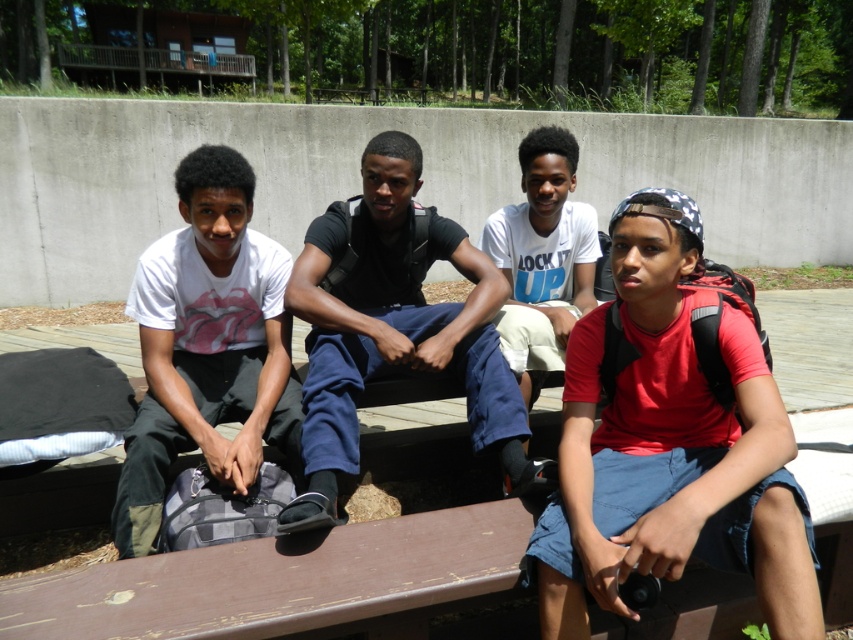
Who is taller, brown wooden bench at center or white matte t-shirt at left?

Standing taller between the two is white matte t-shirt at left.

Describe the element at coordinates (285, 582) in the screenshot. The image size is (853, 640). I see `brown wooden bench at center` at that location.

Find the location of a particular element. The width and height of the screenshot is (853, 640). brown wooden bench at center is located at coordinates tap(285, 582).

Between red matte shirt at right and white cotton shirt at center, which one appears on the left side from the viewer's perspective?

white cotton shirt at center is more to the left.

Who is lower down, red matte shirt at right or white cotton shirt at center?

red matte shirt at right

This screenshot has width=853, height=640. Describe the element at coordinates (670, 448) in the screenshot. I see `red matte shirt at right` at that location.

At what (x,y) coordinates should I click in order to perform the action: click on red matte shirt at right. Please return your answer as a coordinate pair (x, y). Image resolution: width=853 pixels, height=640 pixels. Looking at the image, I should click on (x=670, y=448).

Can you confirm if red matte shirt at right is bigger than white matte t-shirt at left?

No, red matte shirt at right is not bigger than white matte t-shirt at left.

Does point (682, 298) come in front of point (143, 342)?

That is True.

What do you see at coordinates (670, 448) in the screenshot? I see `red matte shirt at right` at bounding box center [670, 448].

Where is `red matte shirt at right`? red matte shirt at right is located at coordinates (670, 448).